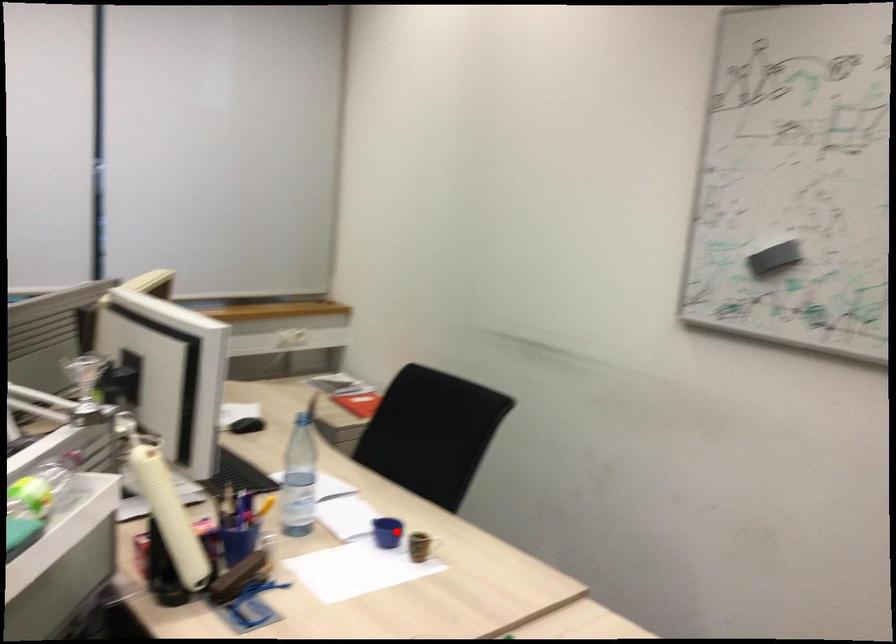
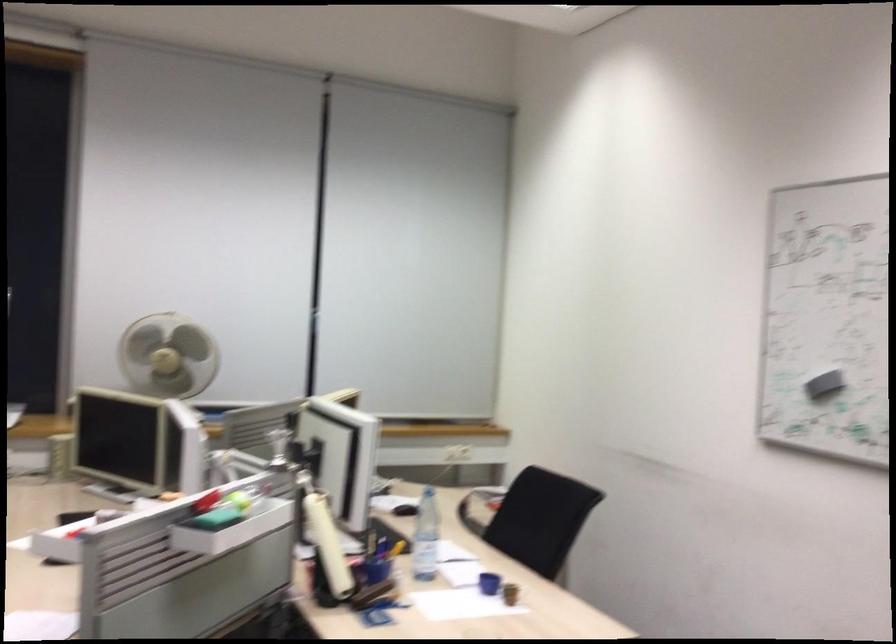
The point at the highlighted location is marked in the first image. Where is the corresponding point in the second image?

(488, 583)